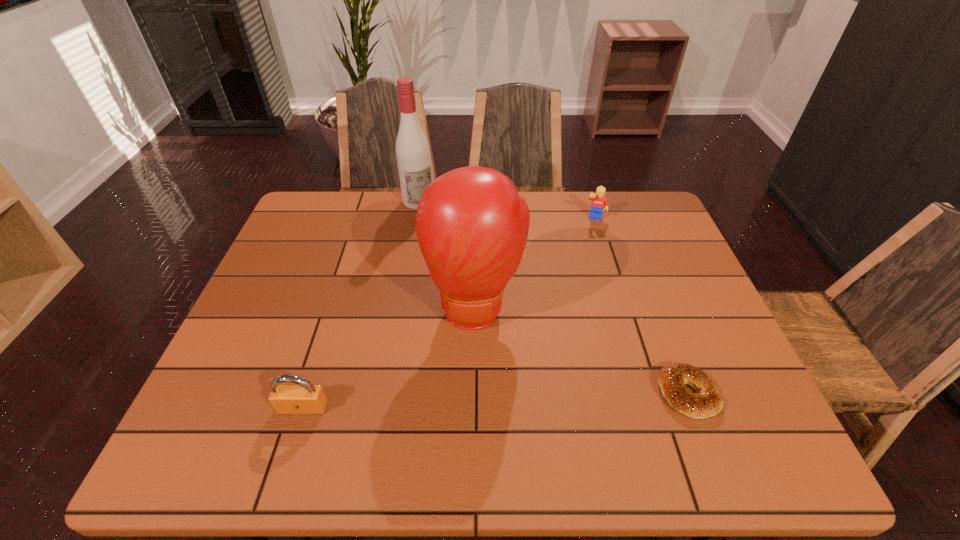
Where is `vacant spot on the desktop that is between the leftmost object and the bagel and is positioned on the striking surface of the boxing glove`? vacant spot on the desktop that is between the leftmost object and the bagel and is positioned on the striking surface of the boxing glove is located at coordinates click(476, 401).

Where is `vacant space on the desktop that is between the padlock and the shortest object and is positioned on the label of the farthest object`? The height and width of the screenshot is (540, 960). vacant space on the desktop that is between the padlock and the shortest object and is positioned on the label of the farthest object is located at coordinates (525, 399).

This screenshot has width=960, height=540. What are the coordinates of `vacant spot on the desktop that is between the padlock and the shortest object and is positioned on the face of the Lego` in the screenshot? It's located at pyautogui.click(x=548, y=398).